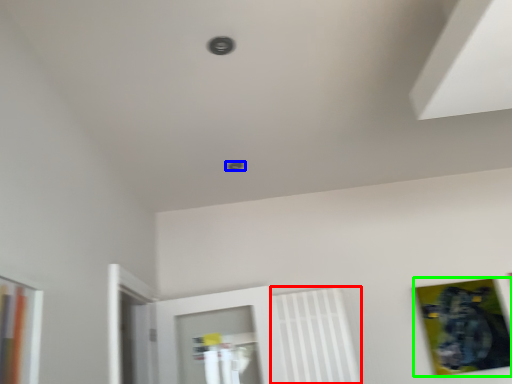
Question: Estimate the real-world distances between objects in this image. Which object is farther from radiator (highlighted by a red box), hole (highlighted by a blue box) or picture frame (highlighted by a green box)?

Choices:
 (A) hole
 (B) picture frame

Answer: (A)